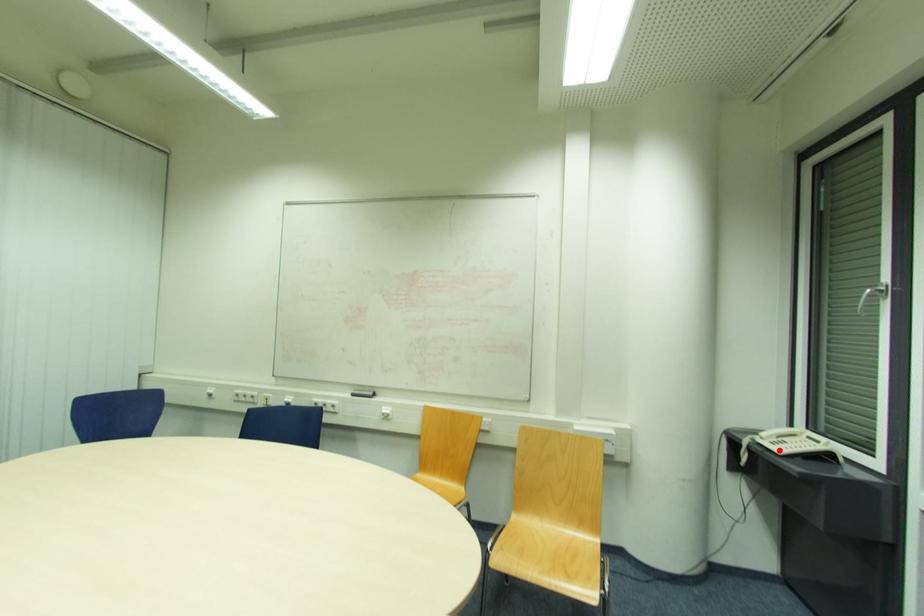
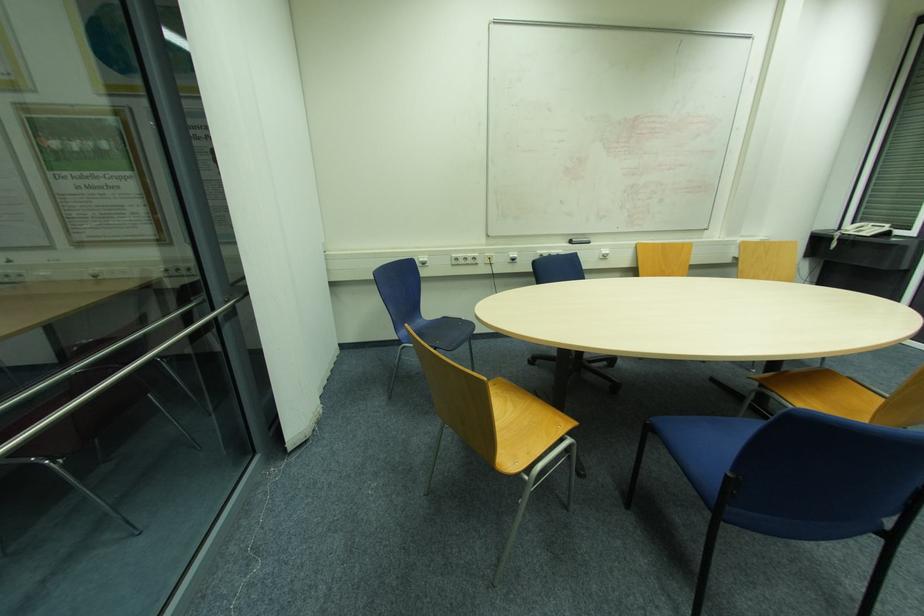
The point at the highlighted location is marked in the first image. Where is the corresponding point in the second image?

(869, 233)